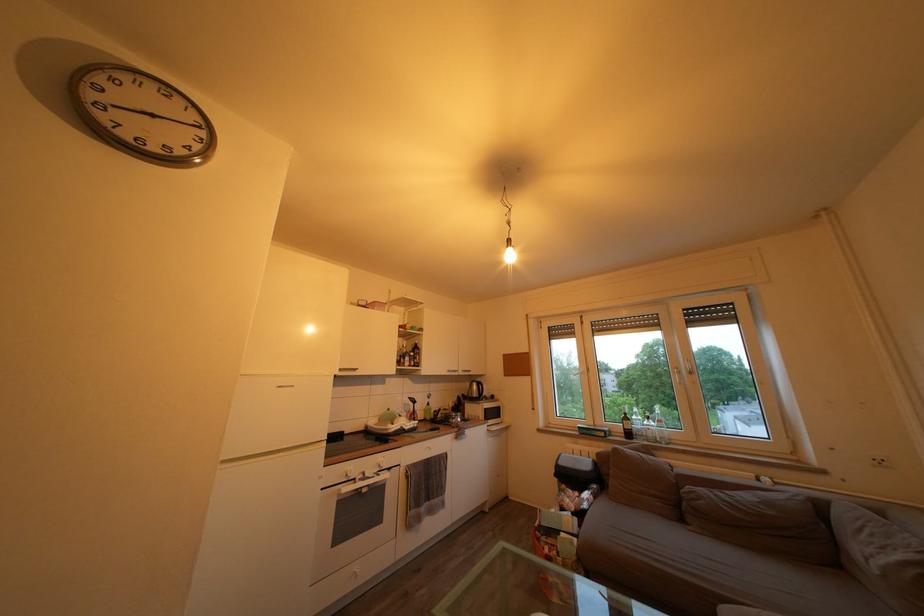
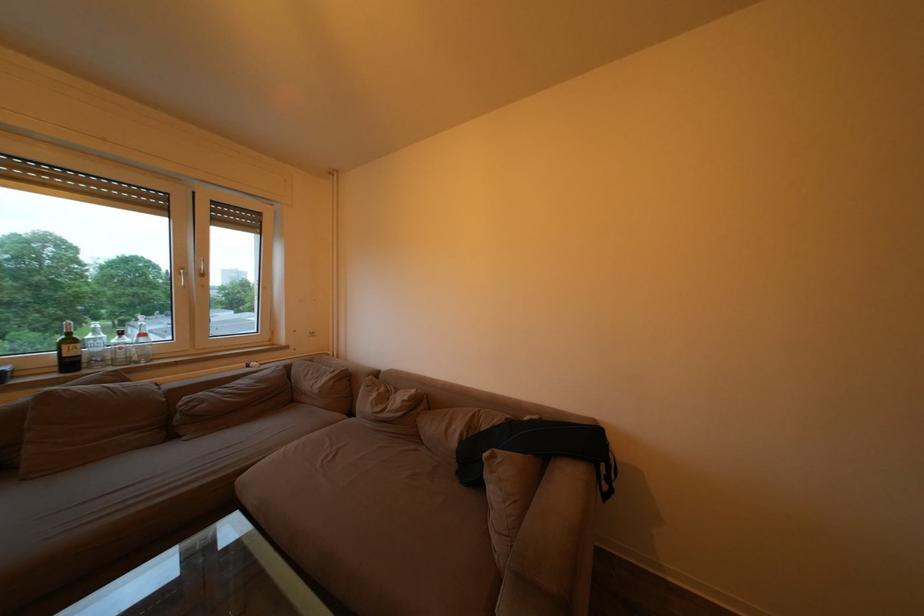
In the second image, find the point that corresponds to point 667,428 in the first image.

(151, 341)